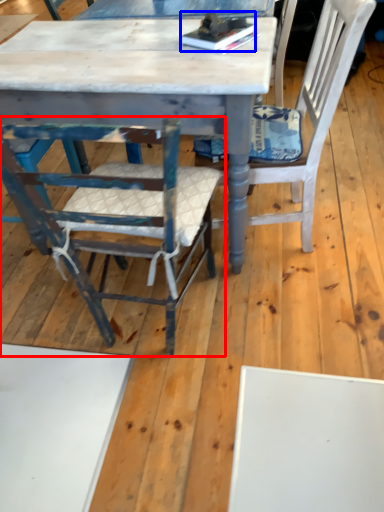
Question: Which point is further to the camera, chair (highlighted by a red box) or book (highlighted by a blue box)?

Choices:
 (A) chair
 (B) book

Answer: (B)